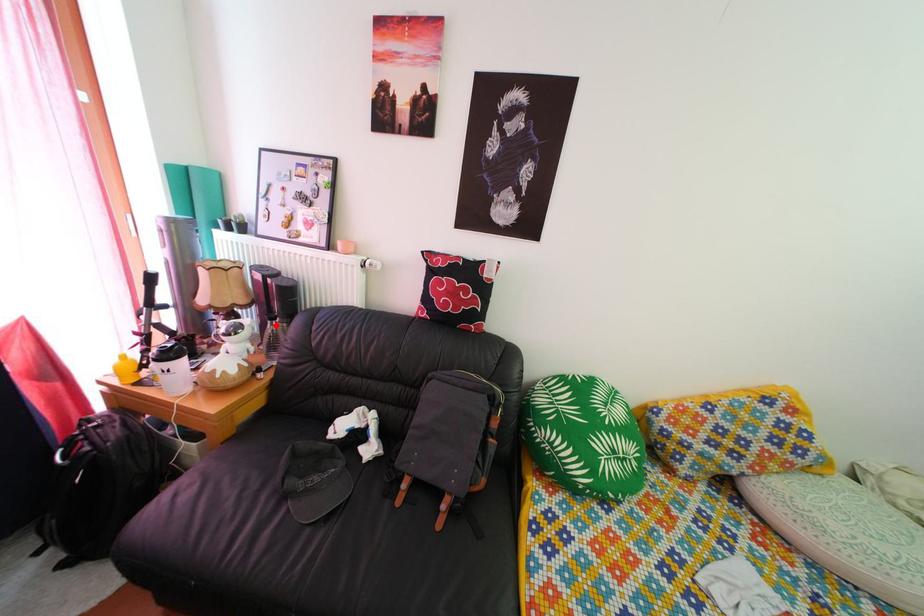
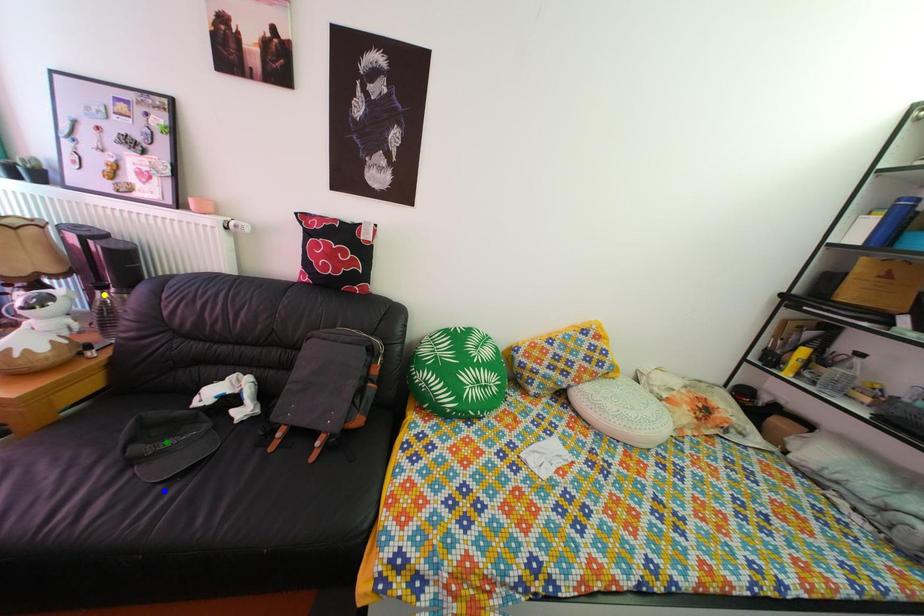
Question: I am providing you with two images of the same scene from different viewpoints. A red point is marked on the first image. You are given multiple points on the second image. Which point in image 2 is actually the same real-world point as the red point in image 1?

Choices:
 (A) yellow point
 (B) green point
 (C) blue point

Answer: (A)